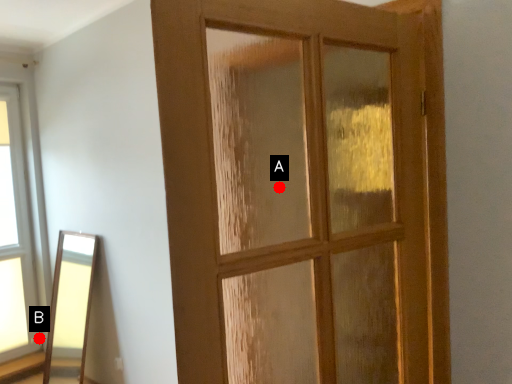
Question: Two points are circled on the image, labeled by A and B beside each circle. Among these points, which one is farthest from the camera?

Choices:
 (A) A is further
 (B) B is further

Answer: (B)